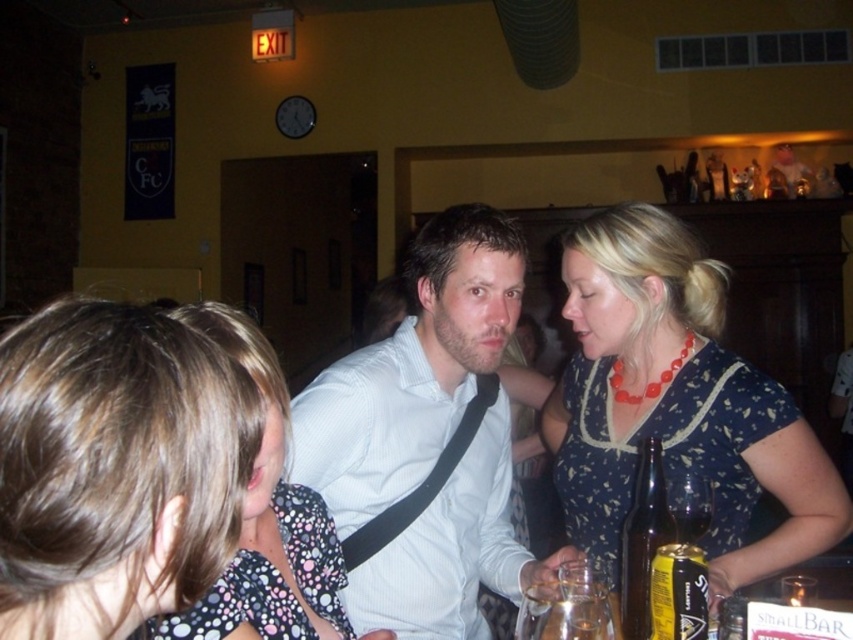
Who is positioned more to the right, clear glass bottle at lower center or translucent glass at lower right?

From the viewer's perspective, clear glass bottle at lower center appears more on the right side.

The width and height of the screenshot is (853, 640). I want to click on clear glass bottle at lower center, so click(815, 579).

Looking at this image, between white textured shirt at center and translucent glass at lower right, which one appears on the right side from the viewer's perspective?

translucent glass at lower right is more to the right.

Between white textured shirt at center and translucent glass at lower right, which one has less height?

Standing shorter between the two is translucent glass at lower right.

Find the location of a particular element. The image size is (853, 640). white textured shirt at center is located at coordinates tap(427, 442).

Does brown glass bottle at lower right have a lesser height compared to translucent glass at lower right?

In fact, brown glass bottle at lower right may be taller than translucent glass at lower right.

Who is higher up, brown glass bottle at lower right or translucent glass at lower right?

translucent glass at lower right is higher up.

Find the location of a particular element. brown glass bottle at lower right is located at coordinates (643, 540).